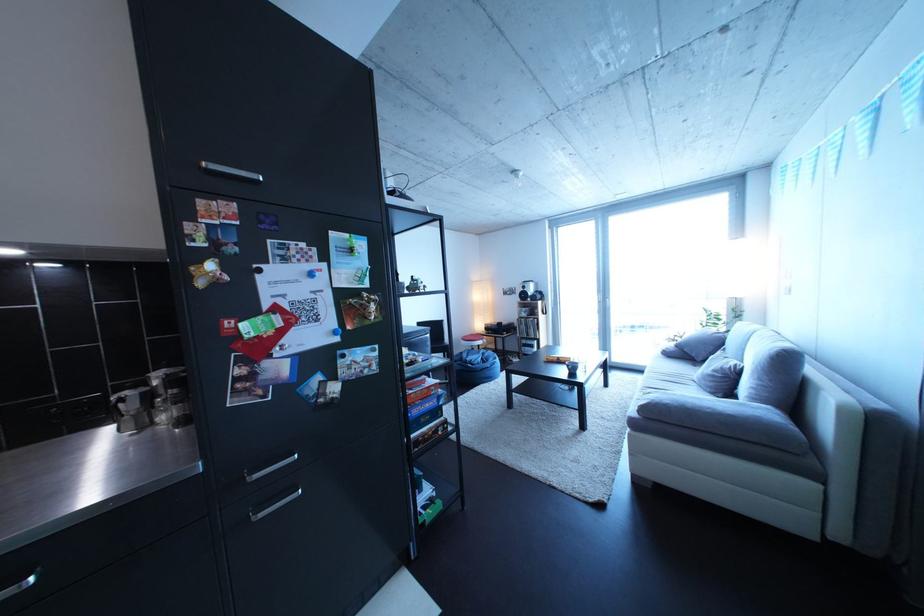
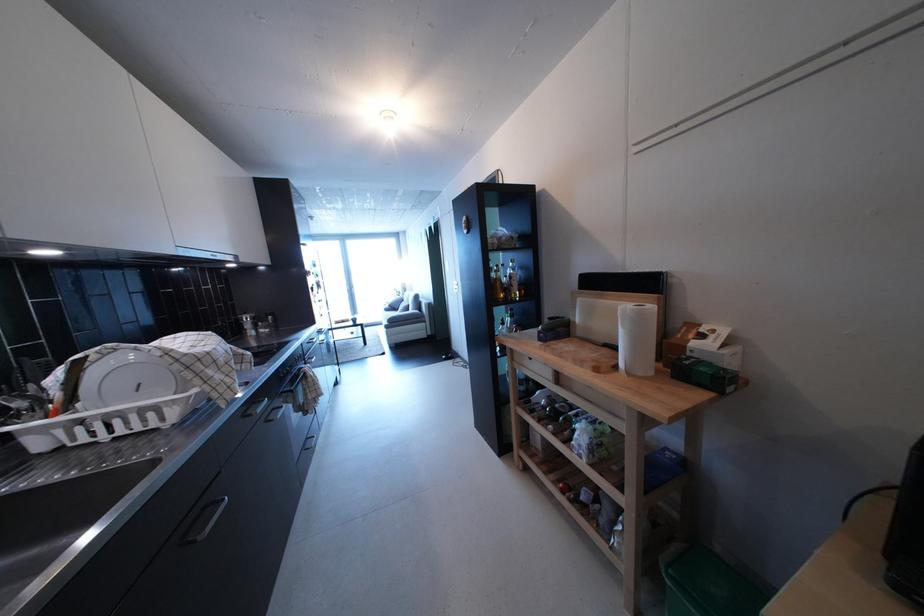
Question: I am providing you with two images of the same scene from different viewpoints. Please identify which objects are invisible in image2.

Choices:
 (A) sofa armrest
 (B) black handle knife
 (C) small black bowl
 (D) gold closet knob

Answer: (C)